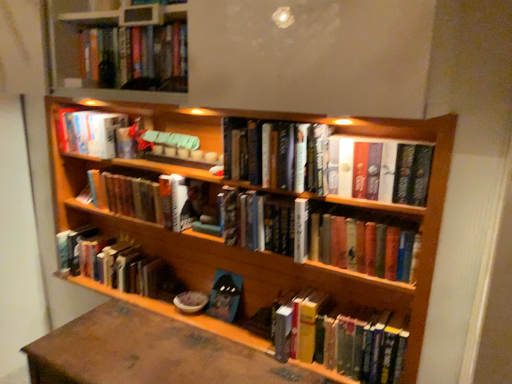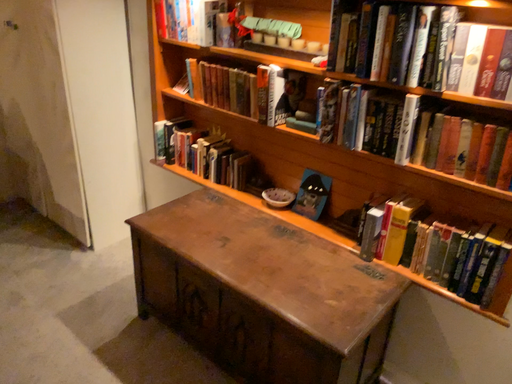
Question: How did the camera likely rotate when shooting the video?

Choices:
 (A) rotated left
 (B) rotated right

Answer: (A)